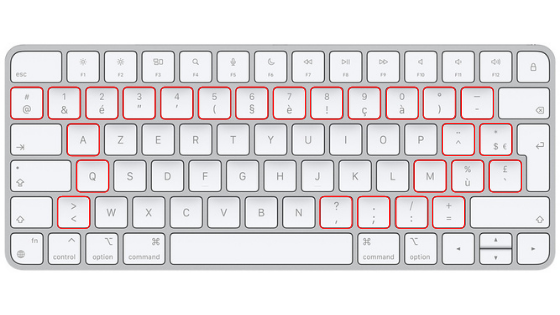
You are a GUI agent. You are given a task and a screenshot of the screen. Output one action in this format:
    pyautogui.click(x=<x>, y=<y>)
    Task: Click on the number keys on a keyboard
    
    Given the screenshot: What is the action you would take?
    pyautogui.click(x=67, y=100), pyautogui.click(x=111, y=103), pyautogui.click(x=138, y=102), pyautogui.click(x=174, y=102), pyautogui.click(x=218, y=102), pyautogui.click(x=250, y=102), pyautogui.click(x=292, y=103), pyautogui.click(x=322, y=104), pyautogui.click(x=356, y=105), pyautogui.click(x=400, y=104)